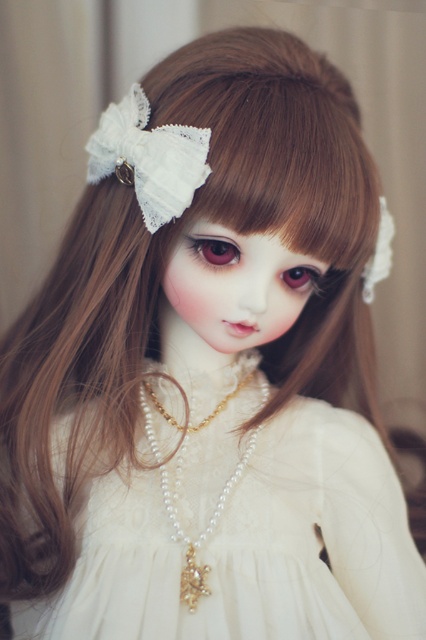
Can you confirm if white lace dress at center is thinner than white lace bow at upper left?

No.

In the scene shown: Can you confirm if white lace dress at center is positioned above white lace bow at upper left?

No.

Does point (394, 609) come closer to viewer compared to point (187, 128)?

No, (394, 609) is behind (187, 128).

I want to click on white lace dress at center, so click(256, 547).

What do you see at coordinates (149, 157) in the screenshot? The image size is (426, 640). I see `white lace bow at upper left` at bounding box center [149, 157].

Identify the location of white lace bow at upper left. (149, 157).

Measure the distance between white lace dress at center and camera.

white lace dress at center and camera are 29.56 inches apart.

Describe the element at coordinates (256, 547) in the screenshot. I see `white lace dress at center` at that location.

The height and width of the screenshot is (640, 426). Identify the location of white lace dress at center. (256, 547).